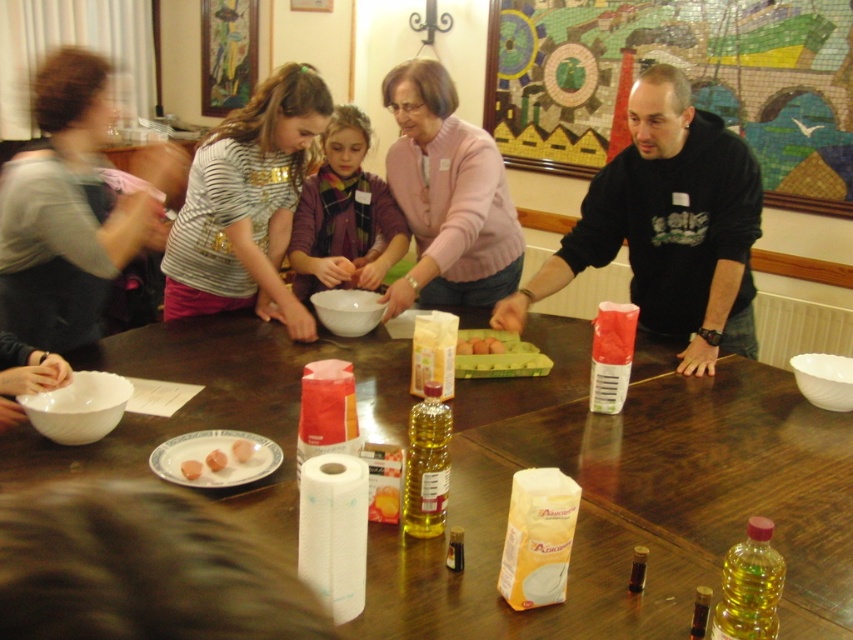
Question: Among these points, which one is nearest to the camera?

Choices:
 (A) (207, 464)
 (B) (248, 451)
 (C) (281, 109)

Answer: (A)

Question: Is pink sweater at center to the left of plaid fabric shirt at center from the viewer's perspective?

Choices:
 (A) yes
 (B) no

Answer: (B)

Question: Which of the following is the closest to the observer?

Choices:
 (A) (212, 452)
 (B) (219, 456)

Answer: (B)

Question: Does pinkish matte sausages at center appear on the right side of brown cardboard egg carton at center?

Choices:
 (A) no
 (B) yes

Answer: (A)

Question: Is plaid fabric shirt at center thinner than pinkish matte sausages at center?

Choices:
 (A) yes
 (B) no

Answer: (B)

Question: Which object appears closest to the camera in this image?

Choices:
 (A) pink glossy hot dog at center
 (B) pinkish matte sausages at center

Answer: (B)